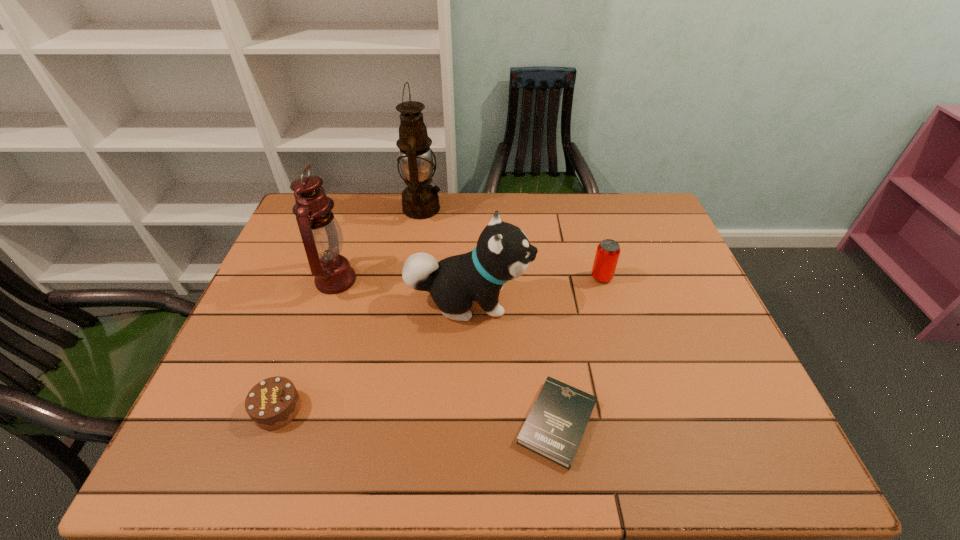
Where is `object that is at the near left corner`? object that is at the near left corner is located at coordinates (274, 402).

In the image, there is a desktop. Identify the location of vacant space at the far edge. This screenshot has width=960, height=540. (443, 217).

You are a GUI agent. You are given a task and a screenshot of the screen. Output one action in this format:
    pyautogui.click(x=<x>, y=<y>)
    Task: Click on the blank area at the near edge
    This screenshot has height=540, width=960.
    Given the screenshot: What is the action you would take?
    pyautogui.click(x=687, y=442)

The image size is (960, 540). Find the location of `vacant space at the right edge of the desktop`. vacant space at the right edge of the desktop is located at coordinates (695, 309).

Where is `free space between the left oil lamp and the third tallest object`? This screenshot has width=960, height=540. free space between the left oil lamp and the third tallest object is located at coordinates (402, 291).

The width and height of the screenshot is (960, 540). Find the location of `vacant region between the second tallest object and the right oil lamp`. vacant region between the second tallest object and the right oil lamp is located at coordinates (379, 244).

Locate an element on the screen. The height and width of the screenshot is (540, 960). free area in between the farthest object and the left oil lamp is located at coordinates (379, 244).

I want to click on free space between the book and the nearer oil lamp, so click(446, 352).

Identify the location of free area in between the shorter oil lamp and the puppy. (402, 291).

Find the location of a particular element. The image size is (960, 540). free space between the shortest object and the fifth tallest object is located at coordinates (418, 416).